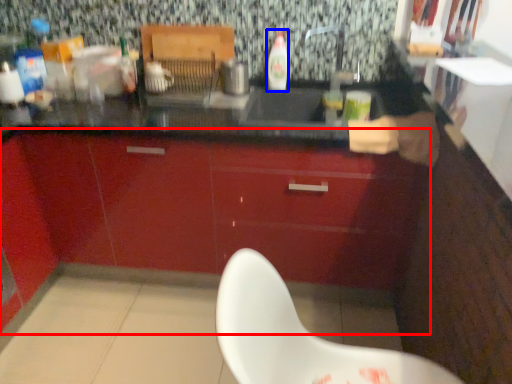
Question: Among these objects, which one is farthest to the camera, cabinetry (highlighted by a red box) or bottle (highlighted by a blue box)?

Choices:
 (A) cabinetry
 (B) bottle

Answer: (B)